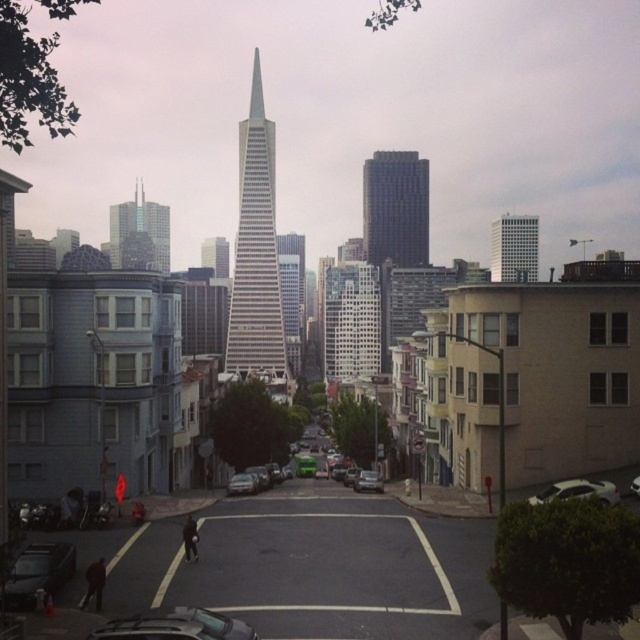
You are a delivery person needing to park your 1.8 meters wide van between the metallic silver sedan at center and the white matte car at center. Can you fit your van there?

The metallic silver sedan at center is wider than the white matte car at center. However, the combined width of both vehicles is not provided, so it is impossible to determine if your van can fit between them.

You are a delivery driver who needs to park your white matte car at center in a parking spot that can only accommodate vehicles up to the size of the metallic silver sedan at center. Can your car fit in the spot?

The metallic silver sedan at center is larger than the white matte car at center, so yes, the white matte car at center can fit in the parking spot designed for the metallic silver sedan at center.

You are standing on the street and see two points marked in the image. The first point is at coordinate point (243, 488) and the second is at coordinate point (632, 481). Which point is closer to you?

Point (632, 481) is closer to you because it is in front of point (243, 488).